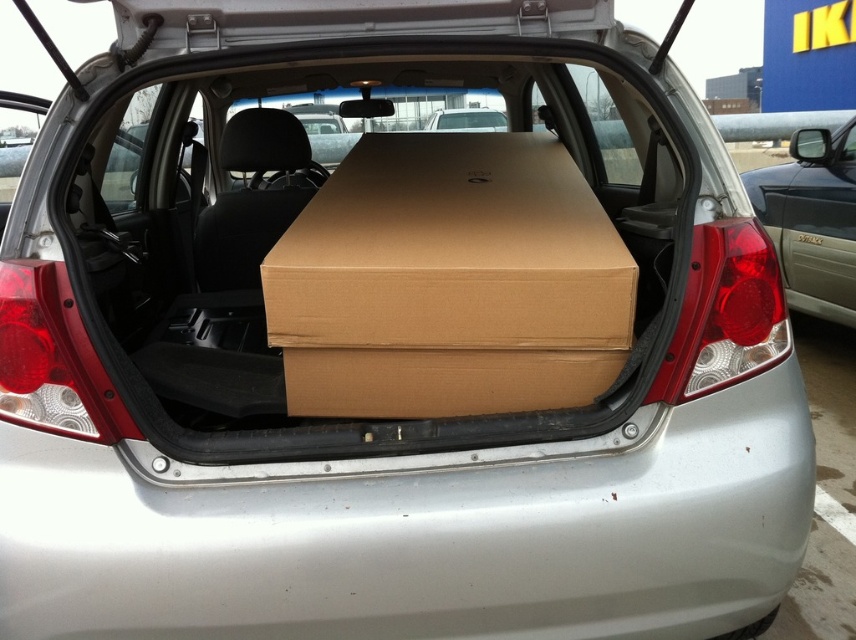
Who is higher up, brown cardboard box at center or matte brown minivan at right?

Positioned higher is matte brown minivan at right.

Find the location of a particular element. The height and width of the screenshot is (640, 856). brown cardboard box at center is located at coordinates (449, 282).

At what (x,y) coordinates should I click in order to perform the action: click on brown cardboard box at center. Please return your answer as a coordinate pair (x, y). This screenshot has height=640, width=856. Looking at the image, I should click on (449, 282).